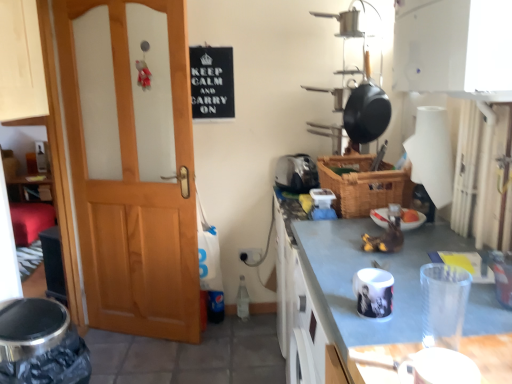
The width and height of the screenshot is (512, 384). I want to click on vacant area that is situated to the right of white glossy mug at center, placed as the 1th appliance when sorted from bottom to top, so click(x=430, y=296).